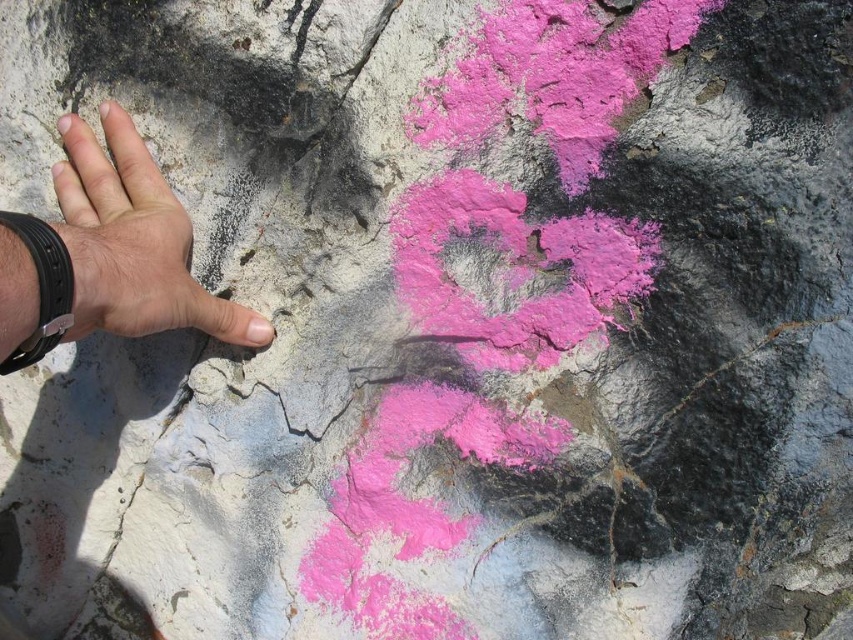
You are an artist trying to paint a scene similar to the one shown. You need to know the relationship between the skinny white hand at left and the cracked stone at center. Which object is covering the other?

The skinny white hand at left is positioned over cracked stone at center, so the hand is covering the stone.

You are an artist who wants to paint on the rock surface. You notice a point at coordinates (132, 241). What object is located at that point?

At point (132, 241) lies the skinny white hand at left.

You are an artist trying to paint a scene similar to the one shown. You notice the skinny white hand at left and the cracked stone at center. Based on their positions, which object would appear larger in your painting if you maintain the same perspective?

The skinny white hand at left would appear larger in your painting because it is closer to the viewer than the cracked stone at center, and objects closer to the viewer generally appear larger in perspective.